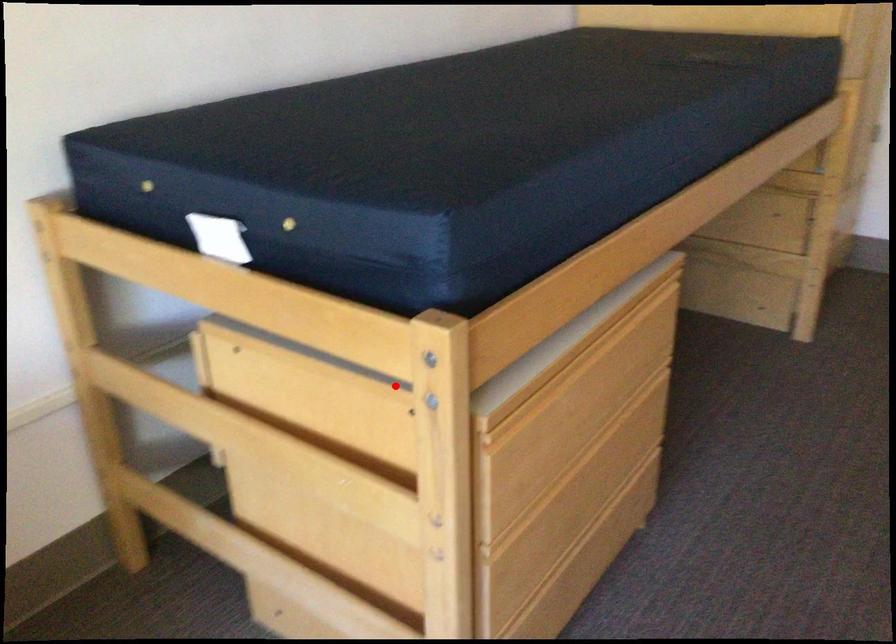
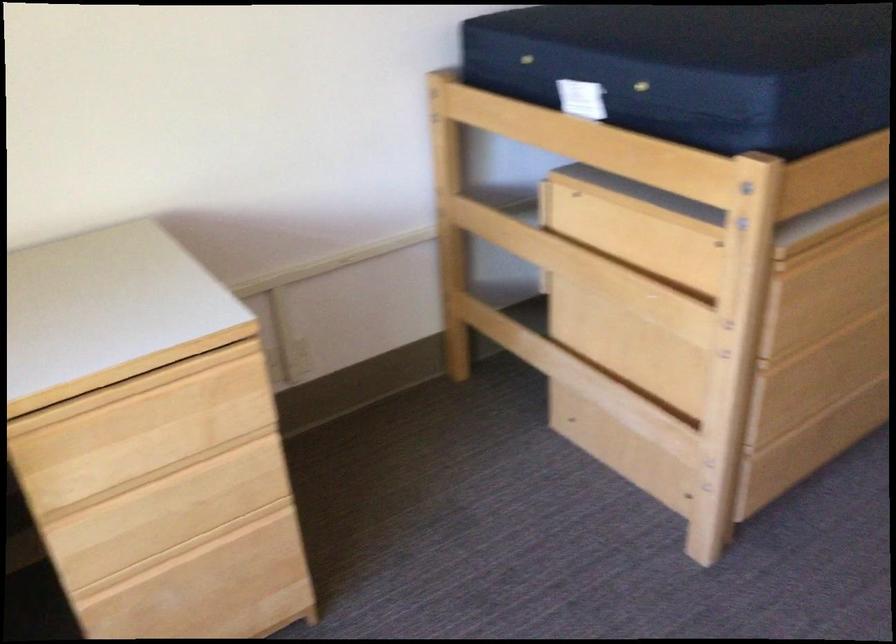
Question: I am providing you with two images of the same scene from different viewpoints. Given a red point in image1, look at the same physical point in image2. Is it:

Choices:
 (A) Closer to the viewpoint
 (B) Farther from the viewpoint

Answer: (B)